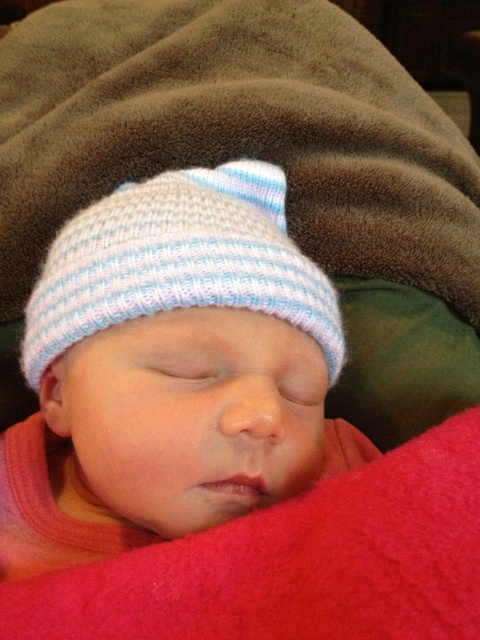
Question: Which point is closer to the camera?

Choices:
 (A) (349, 621)
 (B) (254, 257)

Answer: (A)

Question: Which of the following is the farthest from the observer?

Choices:
 (A) (283, 380)
 (B) (432, 444)

Answer: (A)

Question: Does white knitted hat at center have a greater width compared to light blue knitted hat at upper center?

Choices:
 (A) yes
 (B) no

Answer: (A)

Question: Which object is the farthest from the light blue knitted hat at upper center?

Choices:
 (A) red fleece blanket at lower right
 (B) white knitted hat at center

Answer: (A)

Question: Is white knitted hat at center to the left of light blue knitted hat at upper center from the viewer's perspective?

Choices:
 (A) yes
 (B) no

Answer: (B)

Question: Does white knitted hat at center appear under light blue knitted hat at upper center?

Choices:
 (A) no
 (B) yes

Answer: (B)